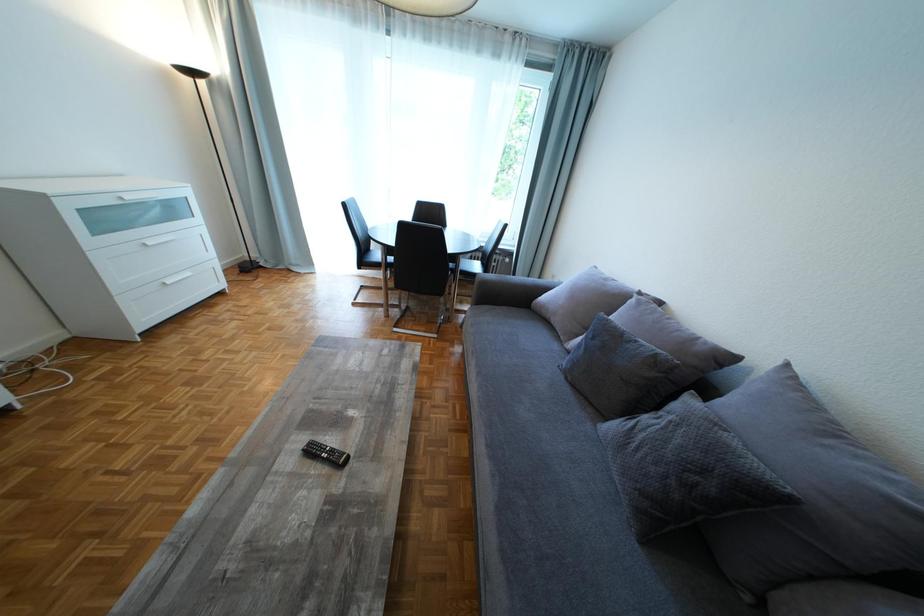
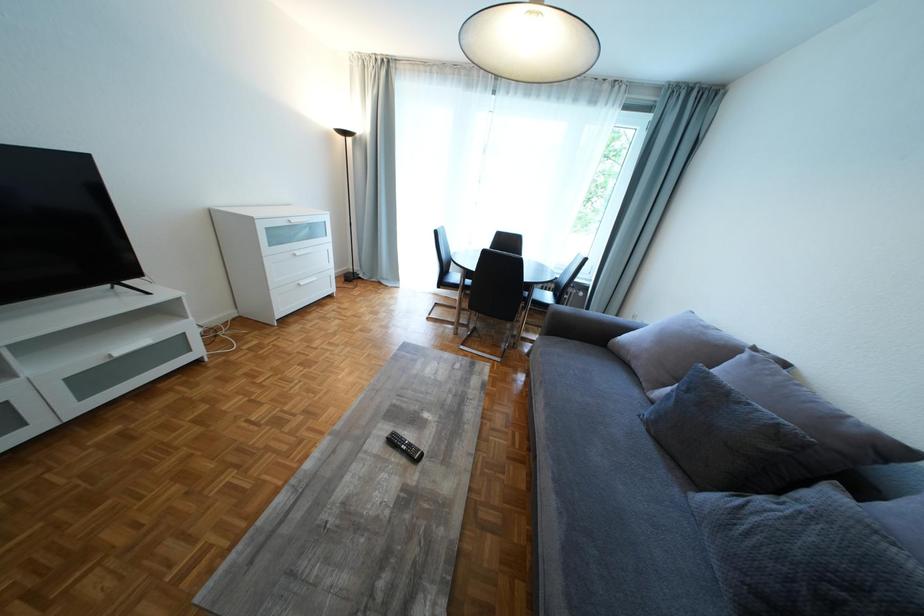
Looking at this image, which direction would the cameraman need to move to produce the second image?

The movement direction of the cameraman is left, backward.